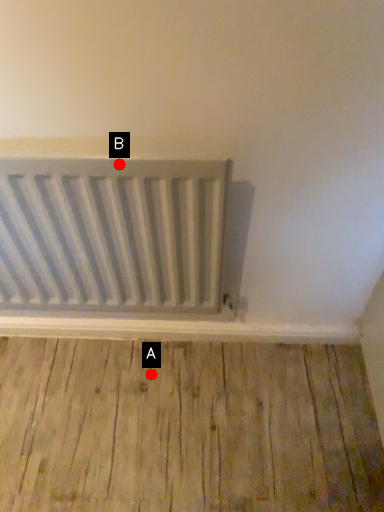
Question: Two points are circled on the image, labeled by A and B beside each circle. Which point appears farthest from the camera in this image?

Choices:
 (A) A is further
 (B) B is further

Answer: (A)